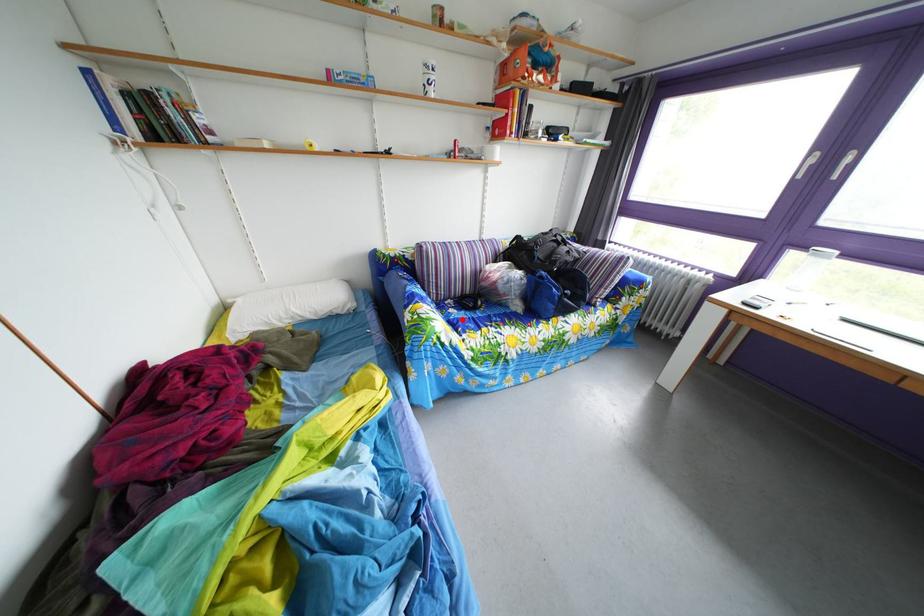
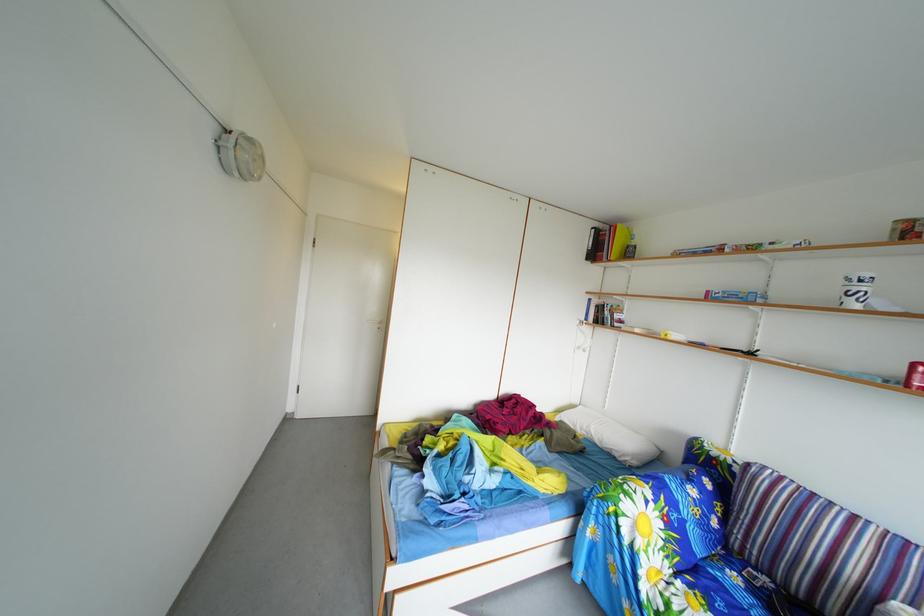
Find the pixel in the second image that matches the highlighted location in the first image.

(746, 585)